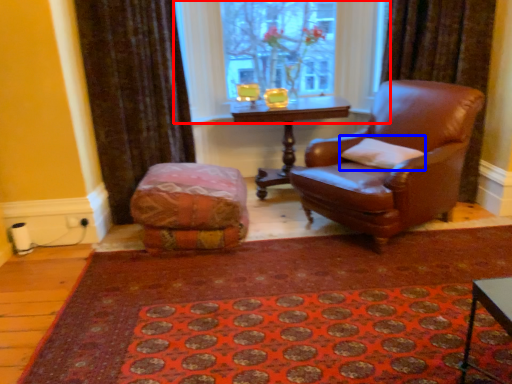
Question: Which object appears farthest to the camera in this image, window (highlighted by a red box) or pillow (highlighted by a blue box)?

Choices:
 (A) window
 (B) pillow

Answer: (A)